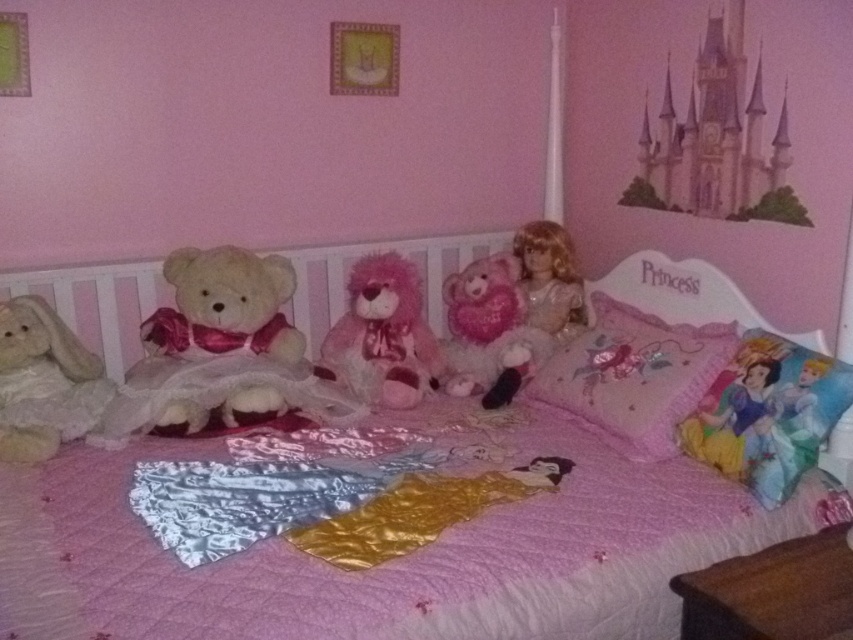
Question: Does pink quilted bed at center have a larger size compared to embroidered cotton pillow at center?

Choices:
 (A) no
 (B) yes

Answer: (B)

Question: Which object appears closest to the camera in this image?

Choices:
 (A) pink plush teddy bear at center
 (B) shiny blonde doll at center
 (C) pink quilted bed at center

Answer: (C)

Question: Which object is positioned closest to the pink plush teddy bear at center?

Choices:
 (A) fluffy pink teddy bear at center
 (B) fluffy beige teddy bear at left
 (C) embroidered cotton pillow at center
 (D) shiny blonde doll at center

Answer: (D)

Question: Which of the following is the closest to the observer?

Choices:
 (A) (474, 342)
 (B) (583, 522)

Answer: (B)

Question: Does fluffy beige teddy bear at left appear on the right side of pink plush teddy bear at center?

Choices:
 (A) yes
 (B) no

Answer: (B)

Question: Does pink quilted bed at center have a smaller size compared to pink plush teddy bear at center?

Choices:
 (A) yes
 (B) no

Answer: (B)